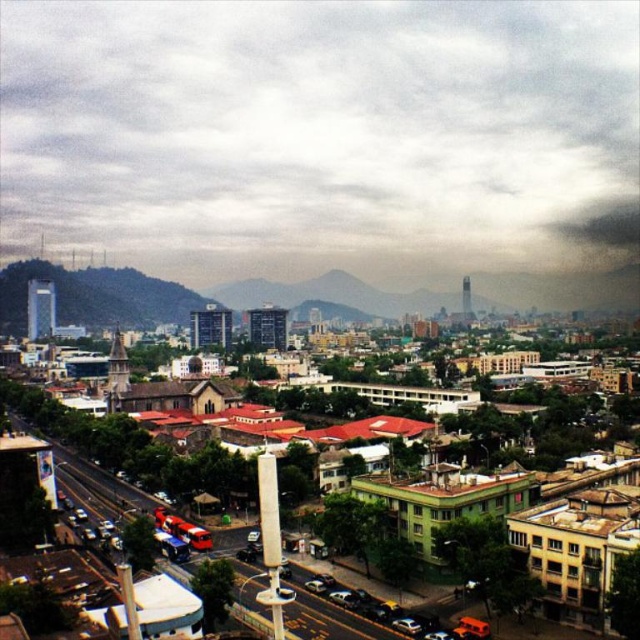
You are a city planner analyzing the city layout. You notice the cloudy sky at upper center and the silver metallic car at lower center. Which of these two elements occupies a higher position in the image?

The cloudy sky at upper center occupies a higher position in the image than the silver metallic car at lower center because the cloudy sky at upper center is much taller as silver metallic car at lower center.

Based on the provided scene description, what is the object located at the coordinates point (321, 134)?

The point (321, 134) corresponds to cloudy sky at upper center.

You are standing at the center of the street and looking towards the buildings. Which object, the brown textured building at lower left or the silver metallic car at lower center, is higher from the ground level?

The brown textured building at lower left is higher from the ground level than the silver metallic car at lower center because it is positioned above it.